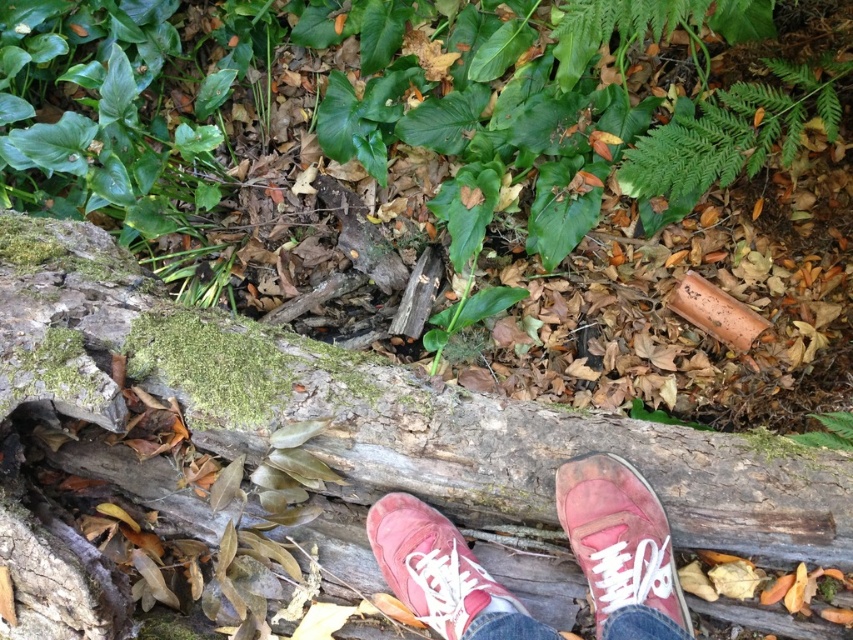
Question: Can you confirm if matte pink canvas shoe at center is positioned below matte pink sneaker at center?

Choices:
 (A) no
 (B) yes

Answer: (A)

Question: Based on their relative distances, which object is nearer to the rough bark log at center?

Choices:
 (A) matte pink sneaker at center
 (B) pink canvas shoes at center
 (C) matte pink canvas shoe at center

Answer: (B)

Question: In this image, where is rough bark log at center located relative to matte pink canvas shoe at center?

Choices:
 (A) left
 (B) right

Answer: (A)

Question: Can you confirm if rough bark log at center is smaller than matte pink sneaker at center?

Choices:
 (A) yes
 (B) no

Answer: (B)

Question: Which point is closer to the camera?

Choices:
 (A) matte pink sneaker at center
 (B) pink canvas shoes at center
 (C) rough bark log at center
 (D) matte pink canvas shoe at center

Answer: (B)

Question: Which of the following is the farthest from the observer?

Choices:
 (A) (659, 532)
 (B) (465, 451)

Answer: (B)